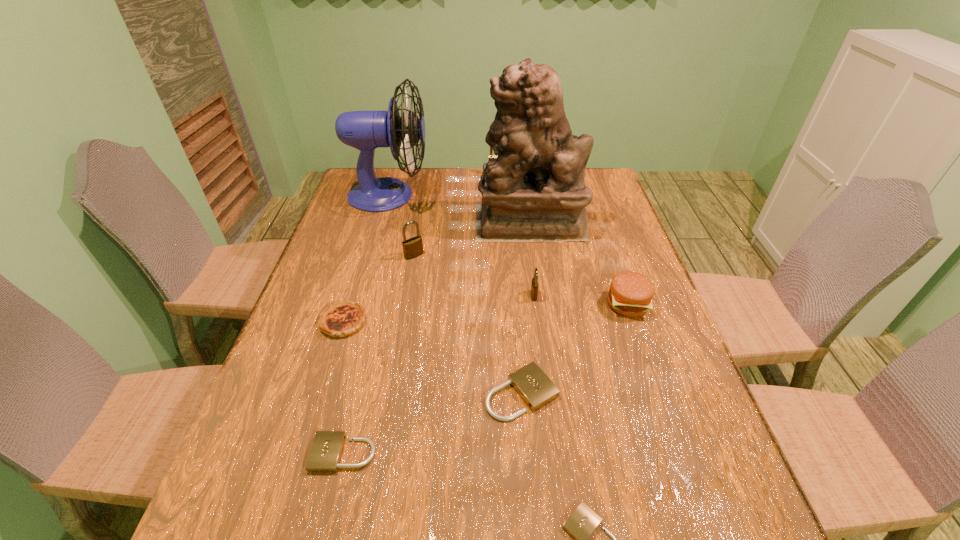
Locate an element on the screen. The image size is (960, 540). beige padlock that can be found as the second closest to the farthest beige padlock is located at coordinates (326, 450).

At what (x,y) coordinates should I click in order to perform the action: click on the second closest beige padlock to the quiche. Please return your answer as a coordinate pair (x, y). Image resolution: width=960 pixels, height=540 pixels. Looking at the image, I should click on (536, 389).

Find the location of `vacant space that satisfies the following two spatial constraints: 1. in front of the fan where the airflow is directed; 2. on the right side of the fifth shortest object`. vacant space that satisfies the following two spatial constraints: 1. in front of the fan where the airflow is directed; 2. on the right side of the fifth shortest object is located at coordinates (358, 304).

Locate an element on the screen. free location that satisfies the following two spatial constraints: 1. on the back side of the quiche; 2. on the right side of the smallest brass padlock is located at coordinates (351, 295).

The width and height of the screenshot is (960, 540). Find the location of `free point that satisfies the following two spatial constraints: 1. on the front side of the biggest beige padlock; 2. on the left side of the second biggest brass padlock`. free point that satisfies the following two spatial constraints: 1. on the front side of the biggest beige padlock; 2. on the left side of the second biggest brass padlock is located at coordinates (390, 393).

Find the location of `free location that satisfies the following two spatial constraints: 1. on the back side of the quiche; 2. on the right side of the sixth tallest object`. free location that satisfies the following two spatial constraints: 1. on the back side of the quiche; 2. on the right side of the sixth tallest object is located at coordinates (348, 304).